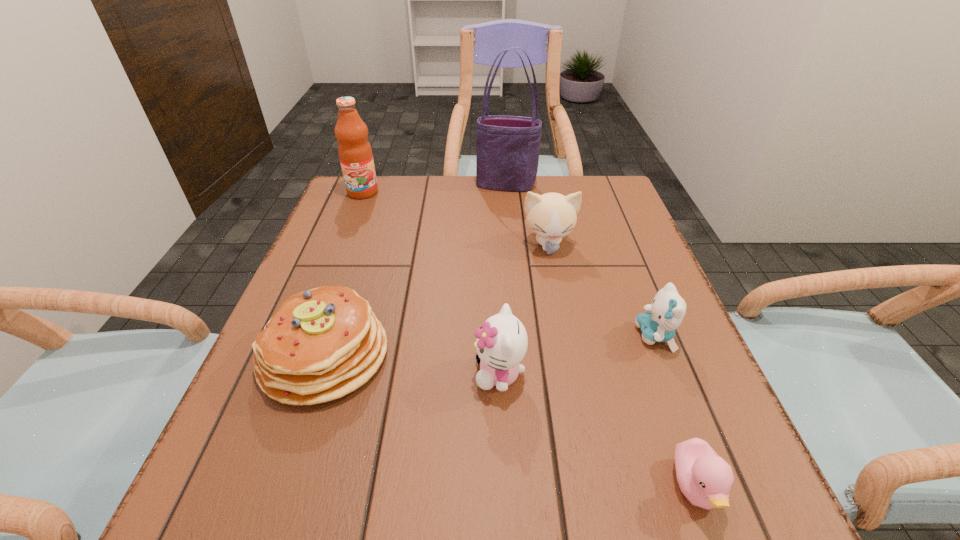
Find the location of a particular element. blank space at the left edge of the desktop is located at coordinates (248, 454).

I want to click on vacant space at the right edge of the desktop, so click(x=654, y=279).

The height and width of the screenshot is (540, 960). Find the location of `free space at the far left corner of the desktop`. free space at the far left corner of the desktop is located at coordinates (342, 208).

Find the location of a particular element. The height and width of the screenshot is (540, 960). vacant space at the near right corner of the desktop is located at coordinates (760, 535).

You are a GUI agent. You are given a task and a screenshot of the screen. Output one action in this format:
    pyautogui.click(x=<x>, y=<y>)
    Task: Click on the unoccupied area between the leftmost kitten and the tallest object
    The image size is (960, 540).
    Given the screenshot: What is the action you would take?
    pyautogui.click(x=503, y=279)

Where is `free spot between the shortest kitten and the tallest object`? free spot between the shortest kitten and the tallest object is located at coordinates (581, 260).

Where is `unoccupied position between the duckling and the sixth shortest object`? unoccupied position between the duckling and the sixth shortest object is located at coordinates (529, 340).

Locate an element on the screen. The image size is (960, 540). vacant point located between the fruit juice and the pancake is located at coordinates (344, 274).

Locate an element on the screen. The width and height of the screenshot is (960, 540). vacant point located between the pancake and the leftmost kitten is located at coordinates (412, 364).

The width and height of the screenshot is (960, 540). What are the coordinates of `vacant area that lies between the pancake and the leftmost kitten` in the screenshot? It's located at (412, 364).